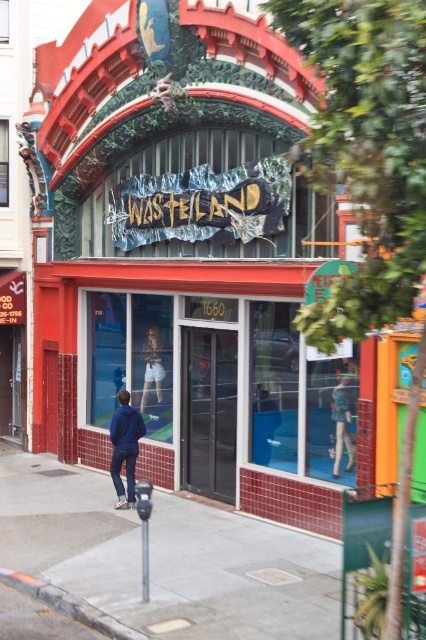
You are standing at the entrance of the WASTELAND store. There is a point marked at coordinates point (160, 561). Where is this point located in relation to the store?

The point (160, 561) is on the gray concrete sidewalk at lower left, which is outside the store.

You are standing in front of the WASTELAND store and see the light blue denim shorts at center. Where exactly are they located in the store window?

The light blue denim shorts at center are located at point [342,420] in the store window.

You are standing on the gray concrete sidewalk at lower left and want to enter the WASTELAND store through its entrance. Which direction should you move relative to the light blue denim shorts at center?

You should move to the right relative to the light blue denim shorts at center because the gray concrete sidewalk at lower left is to the left of the light blue denim shorts at center, so moving right would take you toward the store entrance.